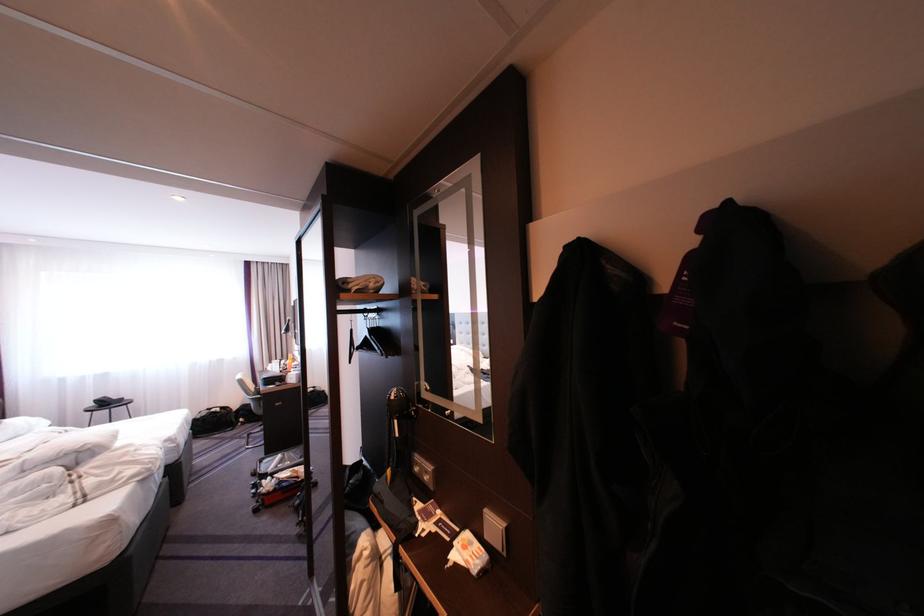
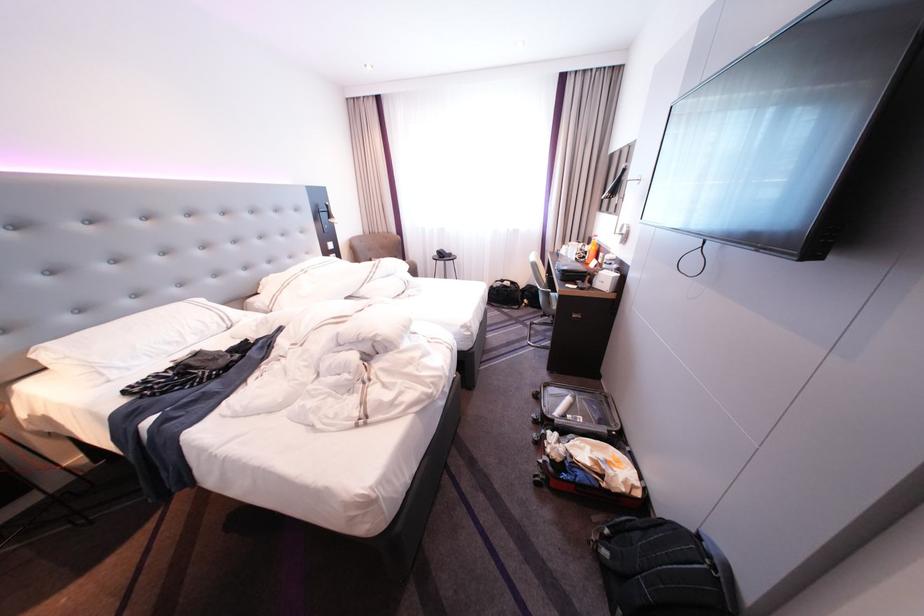
In the second image, find the point that corresponds to point (296, 362) in the first image.

(593, 245)